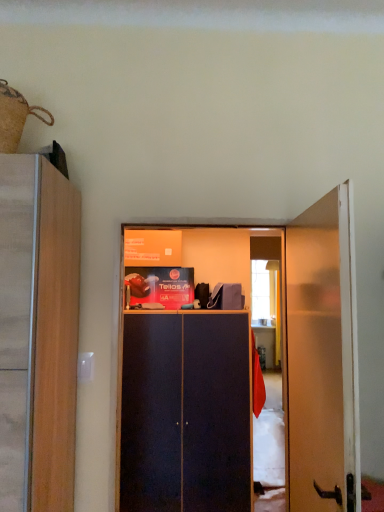
Question: Should I look upward or downward to see burlap sack at upper left?

Choices:
 (A) down
 (B) up

Answer: (B)

Question: From the image's perspective, is wooden door at right over burlap sack at upper left?

Choices:
 (A) no
 (B) yes

Answer: (A)

Question: Is wooden door at right at the left side of burlap sack at upper left?

Choices:
 (A) no
 (B) yes

Answer: (A)

Question: Could burlap sack at upper left be considered to be inside wooden door at right?

Choices:
 (A) yes
 (B) no

Answer: (B)

Question: From a real-world perspective, is wooden door at right physically above burlap sack at upper left?

Choices:
 (A) no
 (B) yes

Answer: (A)

Question: Is wooden door at right directly adjacent to burlap sack at upper left?

Choices:
 (A) no
 (B) yes

Answer: (A)

Question: Is wooden door at right far away from burlap sack at upper left?

Choices:
 (A) no
 (B) yes

Answer: (B)

Question: Is wooden door at right taller than dark wood cabinet at center?

Choices:
 (A) yes
 (B) no

Answer: (B)

Question: From a real-world perspective, is wooden door at right on dark wood cabinet at center?

Choices:
 (A) yes
 (B) no

Answer: (A)

Question: Considering the relative positions of wooden door at right and dark wood cabinet at center in the image provided, is wooden door at right to the right of dark wood cabinet at center from the viewer's perspective?

Choices:
 (A) yes
 (B) no

Answer: (A)

Question: Does wooden door at right have a smaller size compared to dark wood cabinet at center?

Choices:
 (A) no
 (B) yes

Answer: (B)

Question: From the image's perspective, is wooden door at right over dark wood cabinet at center?

Choices:
 (A) yes
 (B) no

Answer: (A)

Question: Can dark wood cabinet at center be found inside wooden door at right?

Choices:
 (A) no
 (B) yes

Answer: (A)

Question: Does dark wood cabinet at center have a lesser height compared to burlap sack at upper left?

Choices:
 (A) yes
 (B) no

Answer: (B)